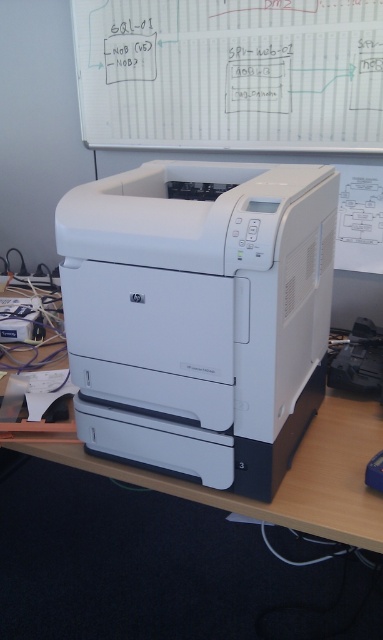
Does white plastic printer at center have a smaller size compared to white matte computer desk at center?

No, white plastic printer at center is not smaller than white matte computer desk at center.

Image resolution: width=383 pixels, height=640 pixels. Find the location of `white plastic printer at center`. white plastic printer at center is located at coordinates (199, 314).

This screenshot has width=383, height=640. I want to click on white plastic printer at center, so click(x=199, y=314).